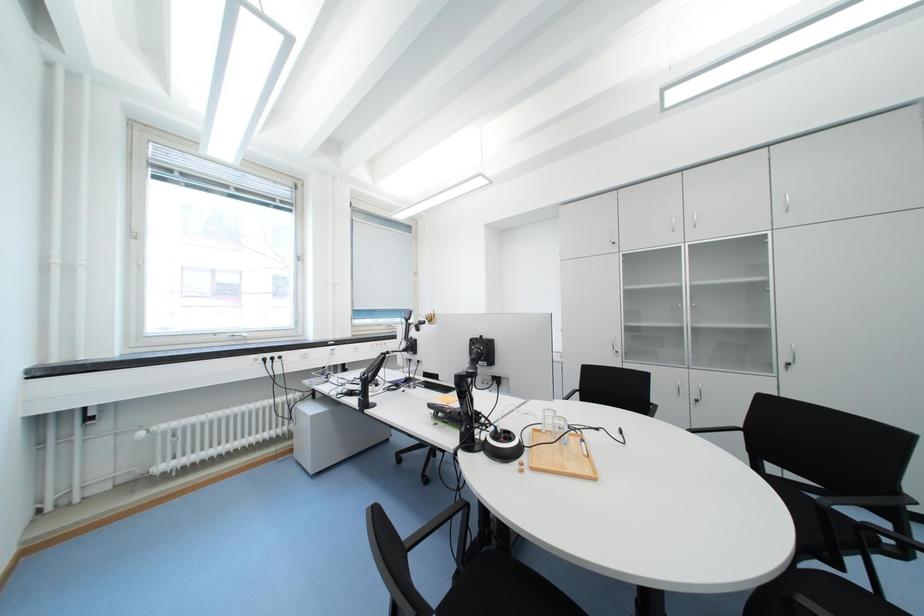
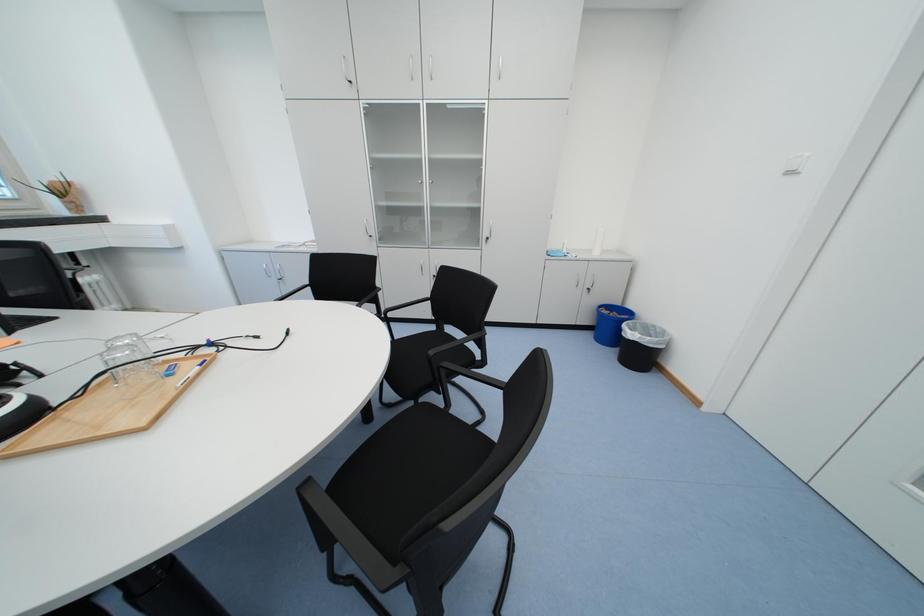
Based on the photo, based on the continuous images, in which direction is the camera rotating?

The rotation direction of the camera is right-down.